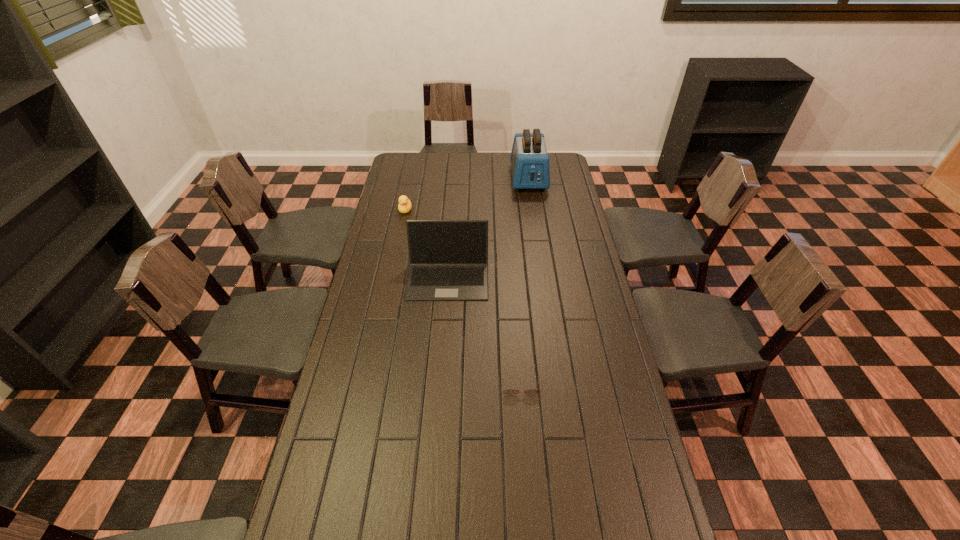
Identify the location of free space located on the face of the second shortest object. The height and width of the screenshot is (540, 960). (393, 273).

You are a GUI agent. You are given a task and a screenshot of the screen. Output one action in this format:
    pyautogui.click(x=<x>, y=<y>)
    Task: Click on the vacant space situated 0.170m on the face of the sunglasses
    The height and width of the screenshot is (540, 960).
    Given the screenshot: What is the action you would take?
    pyautogui.click(x=525, y=449)

Where is `object that is at the far edge`? This screenshot has width=960, height=540. object that is at the far edge is located at coordinates (529, 159).

This screenshot has height=540, width=960. I want to click on object that is at the left edge, so click(404, 206).

Where is `object that is positioned at the right edge`? object that is positioned at the right edge is located at coordinates (529, 159).

The width and height of the screenshot is (960, 540). Find the location of `object located in the far right corner section of the desktop`. object located in the far right corner section of the desktop is located at coordinates (529, 159).

Where is `vacant space at the far edge of the desktop`? Image resolution: width=960 pixels, height=540 pixels. vacant space at the far edge of the desktop is located at coordinates (468, 156).

Where is `free spot at the left edge of the desktop`? The height and width of the screenshot is (540, 960). free spot at the left edge of the desktop is located at coordinates (419, 195).

In the image, there is a desktop. At what (x,y) coordinates should I click in order to perform the action: click on vacant space at the right edge. Please return your answer as a coordinate pair (x, y). The image size is (960, 540). Looking at the image, I should click on (593, 406).

Identify the location of empty space between the farthest object and the sunglasses. (524, 281).